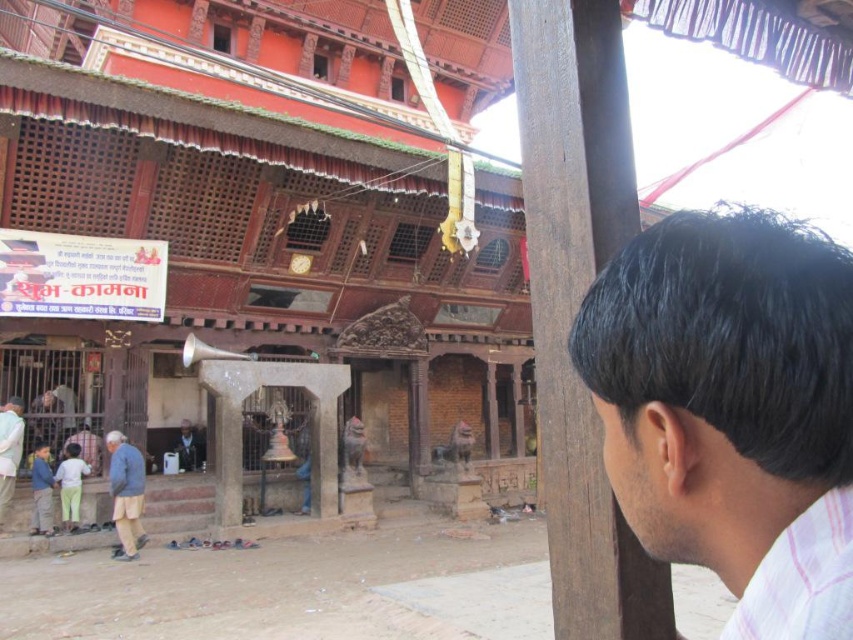
Is point (688, 332) farther from camera compared to point (73, 451)?

No, (688, 332) is closer to viewer.

Which is in front, point (782, 465) or point (74, 481)?

Point (782, 465) is more forward.

Is point (840, 438) farther from viewer compared to point (68, 468)?

No, it is not.

The image size is (853, 640). I want to click on dark brown hair at upper right, so click(721, 385).

The width and height of the screenshot is (853, 640). What are the coordinates of `dark brown hair at upper right` in the screenshot? It's located at (721, 385).

Find the location of `dark brown hair at upper right`. dark brown hair at upper right is located at coordinates (721, 385).

Can you confirm if light blue fabric at lower left is bigger than dark blue shirt at center?

Incorrect, light blue fabric at lower left is not larger than dark blue shirt at center.

Looking at this image, does light blue fabric at lower left have a greater height compared to dark blue shirt at center?

No, light blue fabric at lower left is not taller than dark blue shirt at center.

Is point (4, 444) positioned behind point (173, 449)?

No, (4, 444) is closer to viewer.

This screenshot has height=640, width=853. I want to click on light blue fabric at lower left, so click(x=9, y=451).